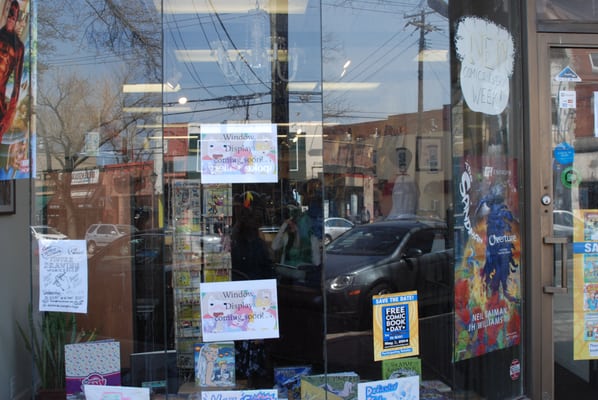
You are a GUI agent. You are given a task and a screenshot of the screen. Output one action in this format:
    pyautogui.click(x=<x>, y=<y>)
    Task: Click on the small poster
    The height and width of the screenshot is (400, 598).
    Given the screenshot: What is the action you would take?
    pyautogui.click(x=73, y=268), pyautogui.click(x=134, y=396), pyautogui.click(x=241, y=393), pyautogui.click(x=233, y=301), pyautogui.click(x=242, y=141), pyautogui.click(x=499, y=81), pyautogui.click(x=388, y=332), pyautogui.click(x=395, y=393)